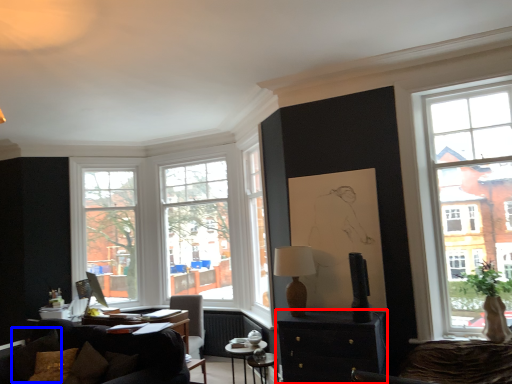
Question: Which object is further to the camera taking this photo, cabinetry (highlighted by a red box) or pillow (highlighted by a blue box)?

Choices:
 (A) cabinetry
 (B) pillow

Answer: (B)